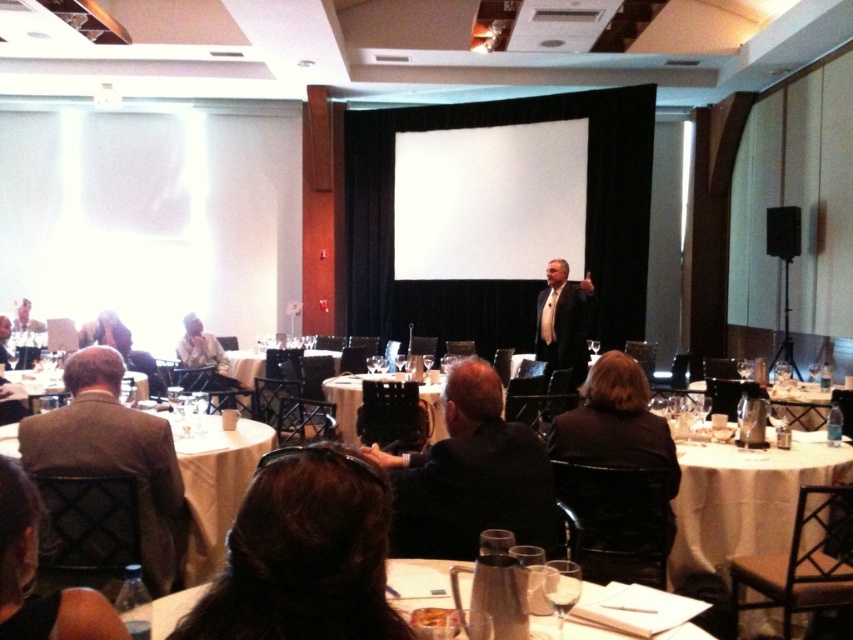
You are an event organizer and need to place a 10 cm wide nameplate on the white glossy table at center. Can the brown hair at center be placed on the same table without overlapping with the nameplate?

The brown hair at center is thinner than the white glossy table at center. Since the nameplate is 10 cm wide, there should be enough space on the table to place both the nameplate and the brown hair at center without overlapping.

You are an attendee at the event and need to find your assigned seat. You see the white glossy table at lower right and the black matte speaker at upper right. Which object is closer to the front of the room?

The white glossy table at lower right is closer to the front of the room because it is located below the black matte speaker at upper right, indicating it is positioned lower in the room layout.

You are an event organizer who needs to ensure that all attendees can see the projection screen. Considering the dark suit at center and the white glossy table at center, which object might block someone sitting behind it from viewing the screen?

The dark suit at center has a larger size compared to the white glossy table at center, so it is more likely to block the view of someone sitting behind it.